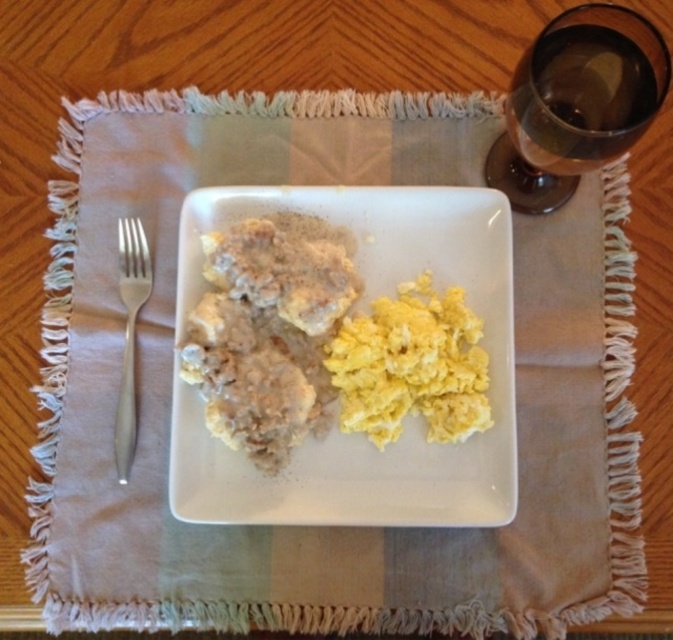
In the scene shown: Between white matte plate at center and yellow scrambled eggs at center, which one has less height?

A: yellow scrambled eggs at center is shorter.

Which is in front, point (336, 509) or point (437, 344)?

Positioned in front is point (336, 509).

You are a GUI agent. You are given a task and a screenshot of the screen. Output one action in this format:
    pyautogui.click(x=<x>, y=<y>)
    Task: Click on the white matte plate at center
    The height and width of the screenshot is (640, 673).
    Given the screenshot: What is the action you would take?
    pyautogui.click(x=359, y=310)

Who is taller, yellow scrambled eggs at center or silver metallic fork at left?

silver metallic fork at left is taller.

Who is more forward, (330,372) or (127,371)?

Point (330,372)

Is point (406, 348) closer to camera compared to point (143, 269)?

Yes.

Locate an element on the screen. The width and height of the screenshot is (673, 640). yellow scrambled eggs at center is located at coordinates (411, 365).

Is white matte plate at center to the left of transparent glass at upper right from the viewer's perspective?

Correct, you'll find white matte plate at center to the left of transparent glass at upper right.

Does white matte plate at center have a lesser height compared to transparent glass at upper right?

No, white matte plate at center is not shorter than transparent glass at upper right.

Which is in front, point (275, 492) or point (621, 54)?

Point (621, 54) is more forward.

Image resolution: width=673 pixels, height=640 pixels. Identify the location of white matte plate at center. (359, 310).